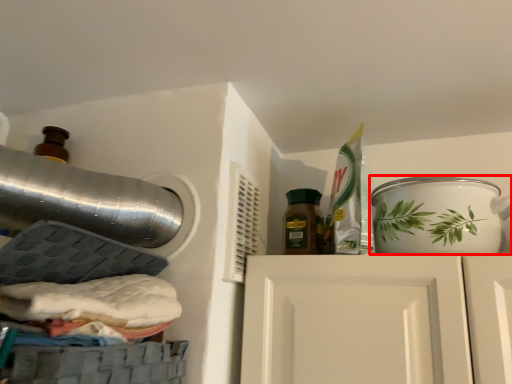
Question: From the image's perspective, where is tableware (annotated by the red box) located relative to bottle?

Choices:
 (A) below
 (B) above

Answer: (A)